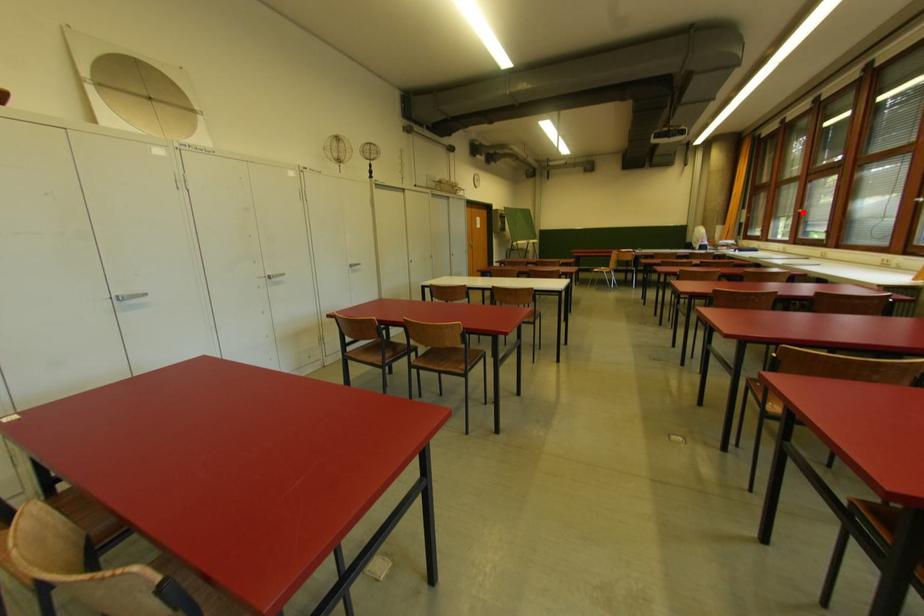
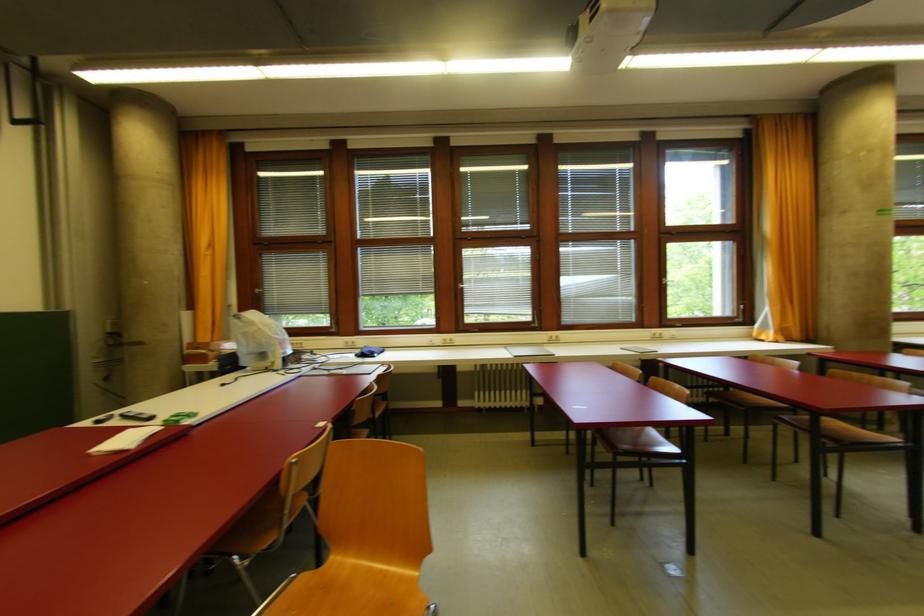
Where in the second image is the point corresponding to the highlighted location from the first image?

(465, 288)